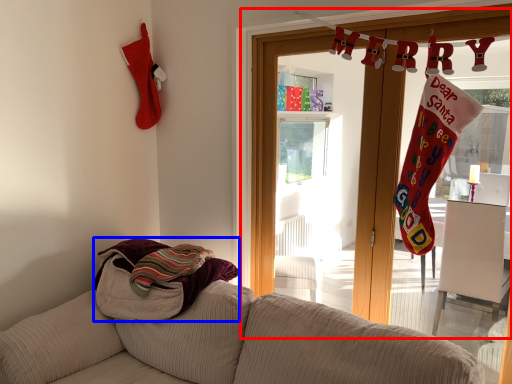
Question: Which point is further to the camera, window frame (highlighted by a red box) or beach towel (highlighted by a blue box)?

Choices:
 (A) window frame
 (B) beach towel

Answer: (B)